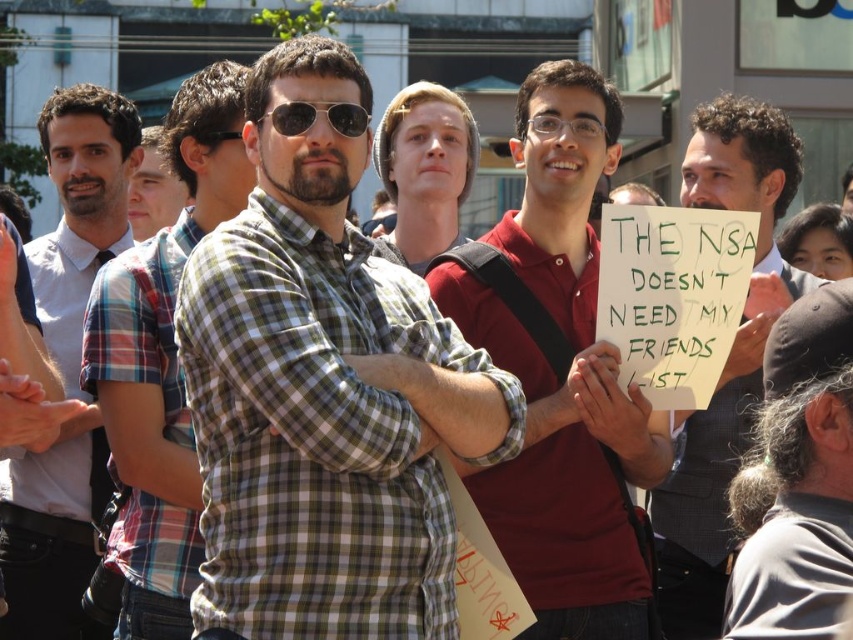
You are a photographer trying to capture a photo of the matte red polo shirt at center and the checkered fabric shirt at center. Which of the two should you focus on first if you want to ensure both are in frame without moving the camera?

The matte red polo shirt at center is taller than the checkered fabric shirt at center, so you should focus on the taller matte red polo shirt at center first to ensure both are in frame without moving the camera.